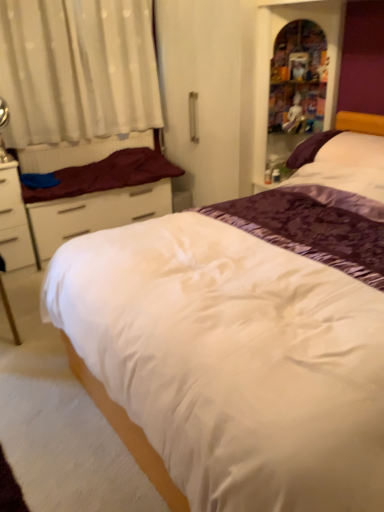
Where is `white satin bed at center`? This screenshot has width=384, height=512. white satin bed at center is located at coordinates (231, 361).

Locate an element on the screen. Image resolution: width=384 pixels, height=512 pixels. purple satin pillow at upper right is located at coordinates (338, 149).

This screenshot has height=512, width=384. What do you see at coordinates (106, 175) in the screenshot?
I see `maroon fabric mattress at left` at bounding box center [106, 175].

You are a GUI agent. You are given a task and a screenshot of the screen. Output one action in this format:
    pyautogui.click(x=<x>, y=<y>)
    Task: Click on the white matte drawer at left
    The image size is (384, 512).
    Given the screenshot: What is the action you would take?
    pyautogui.click(x=95, y=213)

The image size is (384, 512). In order to click on white satin bed at center in this screenshot , I will do `click(231, 361)`.

Does white sheer curtain at upper left turn towards maroon fabric mattress at left?

No, white sheer curtain at upper left is not aimed at maroon fabric mattress at left.

Which object is closer to the camera taking this photo, white sheer curtain at upper left or maroon fabric mattress at left?

Positioned in front is white sheer curtain at upper left.

Is white sheer curtain at upper left taller than maroon fabric mattress at left?

Indeed, white sheer curtain at upper left has a greater height compared to maroon fabric mattress at left.

Is metallic silver table lamp at left oriented away from maroon fabric mattress at left?

That's not correct — metallic silver table lamp at left is not looking away from maroon fabric mattress at left.

Is metallic silver table lamp at left to the left of maroon fabric mattress at left from the viewer's perspective?

Correct, you'll find metallic silver table lamp at left to the left of maroon fabric mattress at left.

In terms of size, does metallic silver table lamp at left appear bigger or smaller than maroon fabric mattress at left?

Clearly, metallic silver table lamp at left is smaller in size than maroon fabric mattress at left.

Looking at this image, is white sheer curtain at upper left bigger than white matte drawer at left?

No, white sheer curtain at upper left is not bigger than white matte drawer at left.

Does point (97, 88) come behind point (64, 220)?

Yes, it is.

The height and width of the screenshot is (512, 384). In order to click on drawer on the right of white sheer curtain at upper left in this screenshot , I will do `click(95, 213)`.

From a real-world perspective, is white sheer curtain at upper left on white matte drawer at left?

Indeed, from a real-world perspective, white sheer curtain at upper left stands above white matte drawer at left.

Does point (302, 10) appear closer or farther from the camera than point (103, 192)?

Point (302, 10) appears to be closer to the viewer than point (103, 192).

Between wooden bookshelf at upper right and white matte drawer at left, which one has larger size?

white matte drawer at left.

Is wooden bookshelf at upper right aimed at white matte drawer at left?

No, wooden bookshelf at upper right is not turned towards white matte drawer at left.

Who is shorter, wooden bookshelf at upper right or white matte drawer at left?

white matte drawer at left.

Between white satin bed at center and white sheer curtain at upper left, which one has larger size?

Bigger between the two is white satin bed at center.

Which is behind, point (327, 186) or point (43, 18)?

The point (43, 18) is behind.

Is white satin bed at center taller or shorter than white sheer curtain at upper left?

In the image, white satin bed at center appears to be taller than white sheer curtain at upper left.

Which of these two, white satin bed at center or white sheer curtain at upper left, is thinner?

With smaller width is white sheer curtain at upper left.

Is wooden bookshelf at upper right not near purple satin pillow at upper right?

No, wooden bookshelf at upper right is not far away from purple satin pillow at upper right.

From the image's perspective, is wooden bookshelf at upper right above or below purple satin pillow at upper right?

wooden bookshelf at upper right is situated higher than purple satin pillow at upper right in the image.

Does white sheer curtain at upper left contain metallic silver table lamp at left?

Actually, metallic silver table lamp at left is outside white sheer curtain at upper left.

Does white sheer curtain at upper left have a larger size compared to metallic silver table lamp at left?

Yes.

Between white sheer curtain at upper left and metallic silver table lamp at left, which one has larger width?

white sheer curtain at upper left is wider.

Looking at this image, is white sheer curtain at upper left facing towards metallic silver table lamp at left?

Yes, white sheer curtain at upper left is facing metallic silver table lamp at left.

Image resolution: width=384 pixels, height=512 pixels. I want to click on mattress behind the white sheer curtain at upper left, so click(106, 175).

You are a GUI agent. You are given a task and a screenshot of the screen. Output one action in this format:
    pyautogui.click(x=<x>, y=<y>)
    Task: Click on the mattress on the right of metallic silver table lamp at left
    The width and height of the screenshot is (384, 512).
    Given the screenshot: What is the action you would take?
    pyautogui.click(x=106, y=175)

When comparing their distances from maroon fabric mattress at left, does white sheer curtain at upper left or wooden bookshelf at upper right seem closer?

Based on the image, white sheer curtain at upper left appears to be nearer to maroon fabric mattress at left.

Which object lies nearer to the anchor point white matte drawer at left, maroon fabric mattress at left or white satin bed at center?

Among the two, maroon fabric mattress at left is located nearer to white matte drawer at left.

Which object lies further to the anchor point maroon fabric mattress at left, white satin bed at center or metallic silver table lamp at left?

white satin bed at center is further to maroon fabric mattress at left.

Looking at the image, which one is located closer to purple satin pillow at upper right, white satin bed at center or maroon fabric mattress at left?

white satin bed at center is positioned closer to the anchor purple satin pillow at upper right.

Based on their spatial positions, is white sheer curtain at upper left or purple satin pillow at upper right further from white matte drawer at left?

purple satin pillow at upper right lies further to white matte drawer at left than the other object.

From the image, which object appears to be farther from purple satin pillow at upper right, white satin bed at center or metallic silver table lamp at left?

metallic silver table lamp at left is further to purple satin pillow at upper right.

Which object lies nearer to the anchor point white satin bed at center, white sheer curtain at upper left or purple satin pillow at upper right?

The object closer to white satin bed at center is purple satin pillow at upper right.

Based on their spatial positions, is purple satin pillow at upper right or maroon fabric mattress at left further from wooden bookshelf at upper right?

maroon fabric mattress at left is further to wooden bookshelf at upper right.

Locate an element on the screen. The width and height of the screenshot is (384, 512). table lamp that lies between white sheer curtain at upper left and white matte drawer at left from top to bottom is located at coordinates (1, 132).

Where is `drawer situated between white sheer curtain at upper left and wooden bookshelf at upper right from left to right`? drawer situated between white sheer curtain at upper left and wooden bookshelf at upper right from left to right is located at coordinates (95, 213).

Find the location of a particular element. mattress between white matte drawer at left and wooden bookshelf at upper right from left to right is located at coordinates (106, 175).

You are a GUI agent. You are given a task and a screenshot of the screen. Output one action in this format:
    pyautogui.click(x=<x>, y=<y>)
    Task: Click on the bookshelf between maroon fabric mattress at left and purple satin pillow at upper right in the horizontal direction
    The width and height of the screenshot is (384, 512).
    Given the screenshot: What is the action you would take?
    coord(271,55)